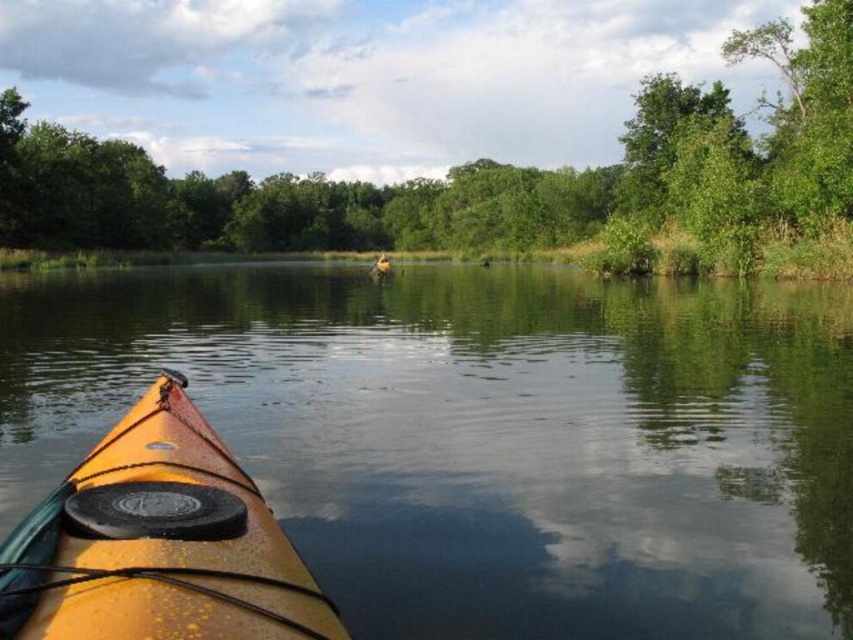
Question: Considering the relative positions of smooth water at center and green leafy tree at center in the image provided, where is smooth water at center located with respect to green leafy tree at center?

Choices:
 (A) above
 (B) below

Answer: (B)

Question: Which object appears farthest from the camera in this image?

Choices:
 (A) smooth water at center
 (B) green leafy tree at center
 (C) matte yellow kayak at lower left

Answer: (B)

Question: Can you confirm if smooth water at center is smaller than matte yellow kayak at lower left?

Choices:
 (A) no
 (B) yes

Answer: (A)

Question: Which point is closer to the camera?

Choices:
 (A) (9, 532)
 (B) (527, 448)

Answer: (A)

Question: Does green leafy tree at center appear on the right side of matte yellow kayak at lower left?

Choices:
 (A) yes
 (B) no

Answer: (A)

Question: Which object is closer to the camera taking this photo?

Choices:
 (A) green leafy tree at center
 (B) matte yellow kayak at lower left

Answer: (B)